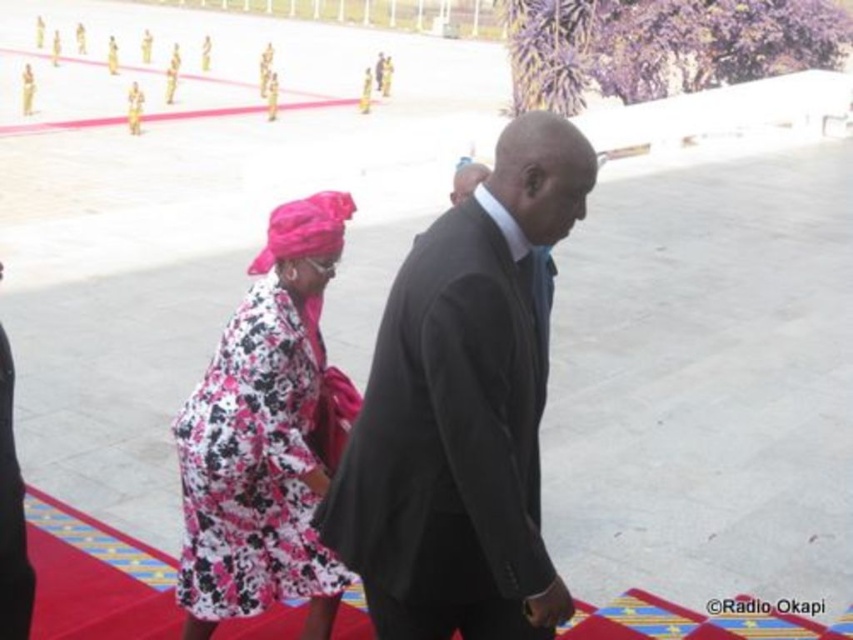
Does dark gray suit at center lie behind floral fabric dress at center?

No, dark gray suit at center is closer to the viewer.

Does dark gray suit at center have a lesser width compared to floral fabric dress at center?

No, dark gray suit at center is not thinner than floral fabric dress at center.

Is point (474, 209) positioned after point (312, 545)?

No, it is not.

At what (x,y) coordinates should I click in order to perform the action: click on dark gray suit at center. Please return your answer as a coordinate pair (x, y). Image resolution: width=853 pixels, height=640 pixels. Looking at the image, I should click on (462, 412).